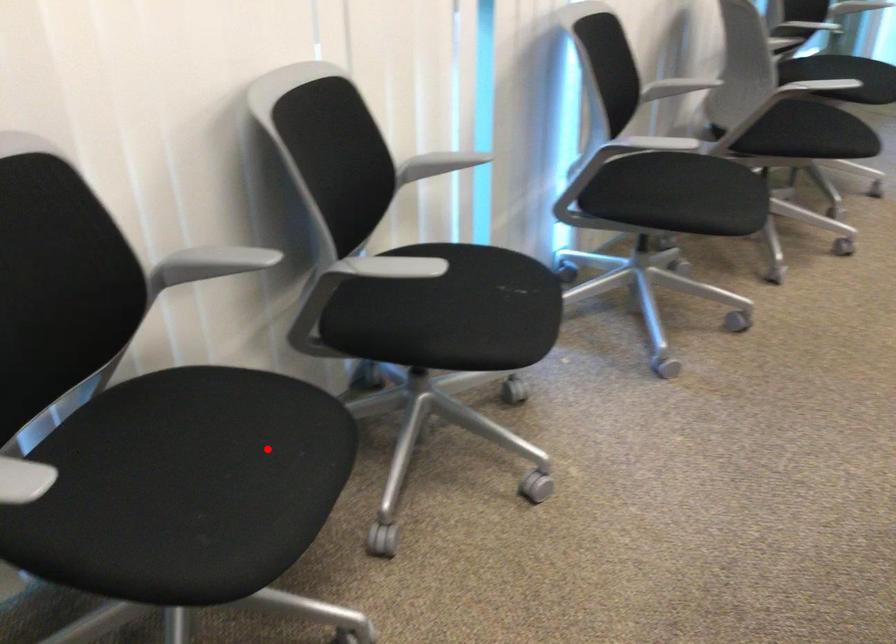
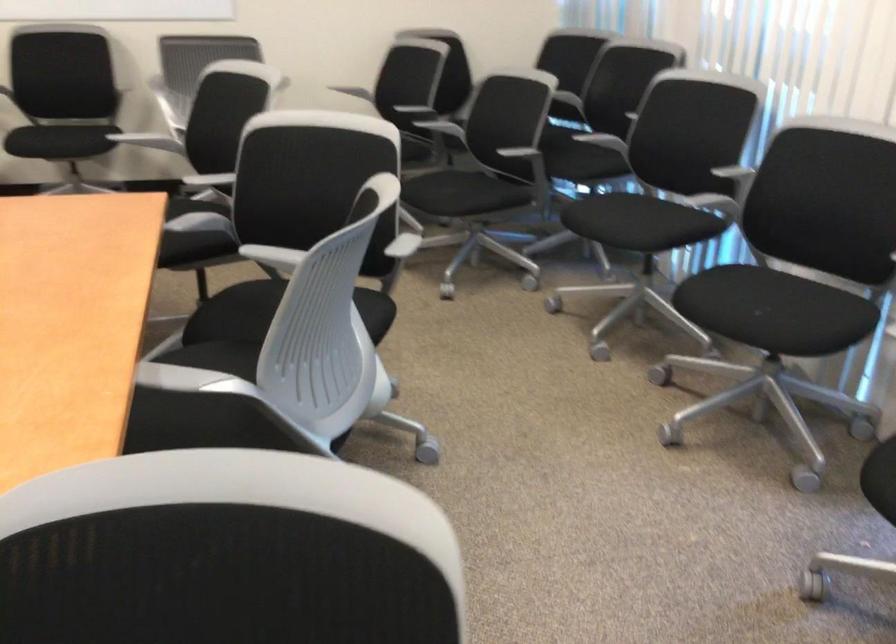
The point at the highlighted location is marked in the first image. Where is the corresponding point in the second image?

(624, 221)